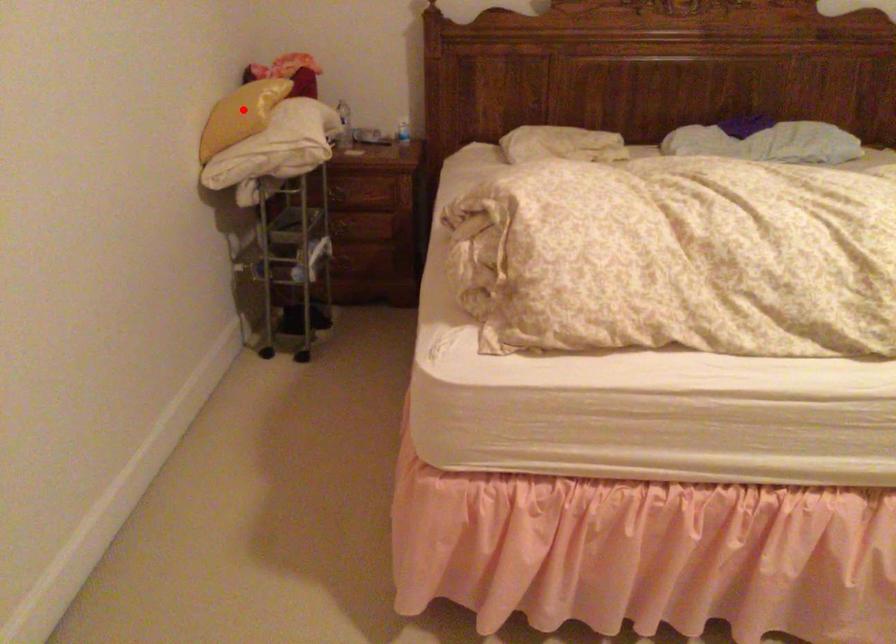
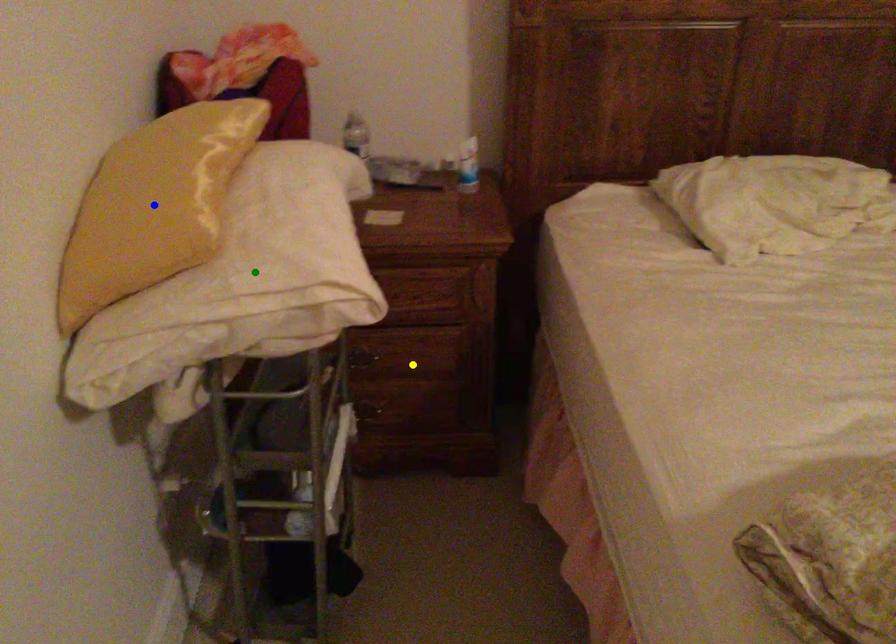
Question: I am providing you with two images of the same scene from different viewpoints. A red point is marked on the first image. You are given multiple points on the second image. Which point in image 2 represents the same 3d spot as the red point in image 1?

Choices:
 (A) green point
 (B) yellow point
 (C) blue point

Answer: (C)